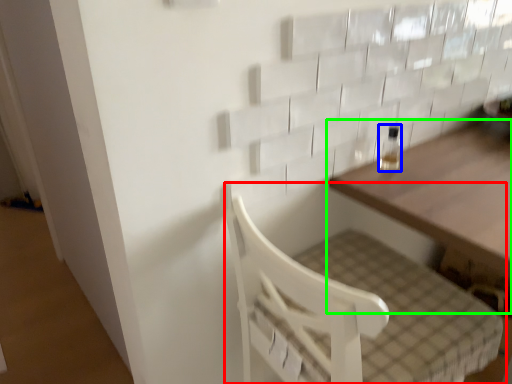
Question: Which is nearer to the furniture (highlighted by a red box)? bottle (highlighted by a blue box) or table (highlighted by a green box).

Choices:
 (A) bottle
 (B) table

Answer: (B)